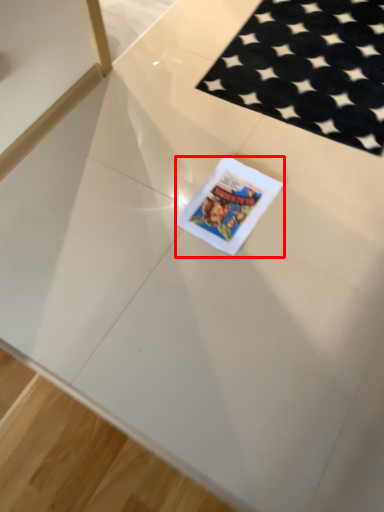
Question: From the image's perspective, where is birthday card (annotated by the red box) located relative to mat?

Choices:
 (A) above
 (B) below

Answer: (B)